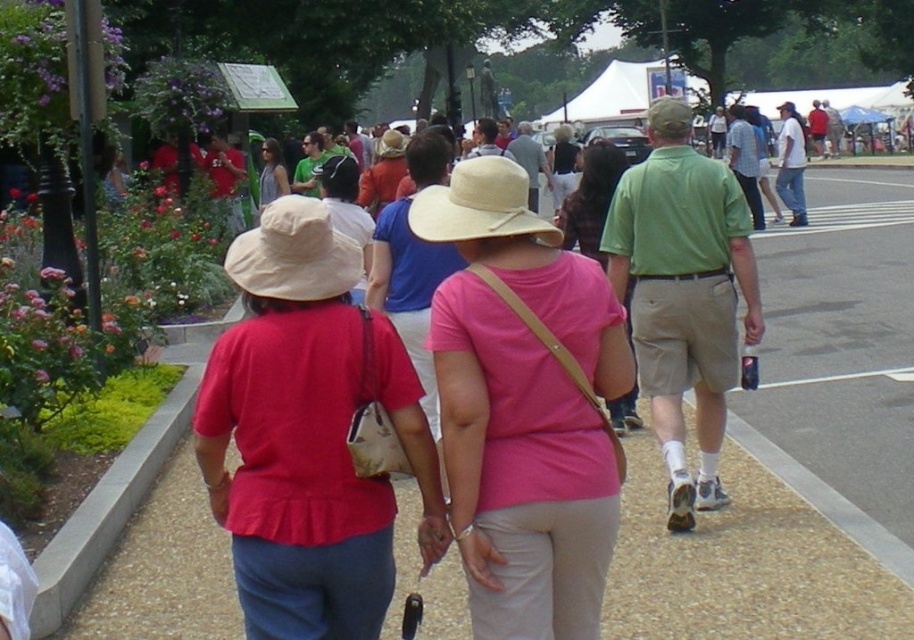
Which is below, pink matte hat at center or matte red shirt at center?

matte red shirt at center is lower down.

How distant is pink matte hat at center from matte red shirt at center?

A distance of 13.64 inches exists between pink matte hat at center and matte red shirt at center.

Identify the location of pink matte hat at center. (524, 406).

In order to click on pink matte hat at center in this screenshot , I will do `click(524, 406)`.

Does pink matte hat at center have a greater height compared to matte gray tank top at center?

Yes, pink matte hat at center is taller than matte gray tank top at center.

Is pink matte hat at center bigger than matte gray tank top at center?

Actually, pink matte hat at center might be smaller than matte gray tank top at center.

Locate an element on the screen. The width and height of the screenshot is (914, 640). pink matte hat at center is located at coordinates (524, 406).

Who is more distant from viewer, (732, 545) or (636, 388)?

Positioned behind is point (636, 388).

Can you confirm if brown gravel path at center is smaller than pink fabric shirt at center?

No, brown gravel path at center is not smaller than pink fabric shirt at center.

Where is `brown gravel path at center`? The width and height of the screenshot is (914, 640). brown gravel path at center is located at coordinates (798, 451).

The height and width of the screenshot is (640, 914). Find the location of `brown gravel path at center`. brown gravel path at center is located at coordinates (798, 451).